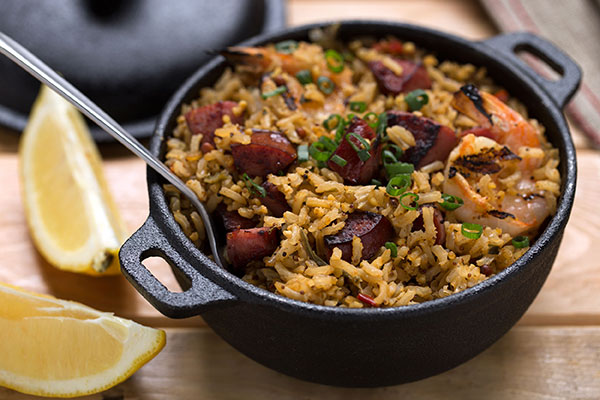
This screenshot has height=400, width=600. In order to click on crack in tabletop in this screenshot , I will do `click(574, 325)`.